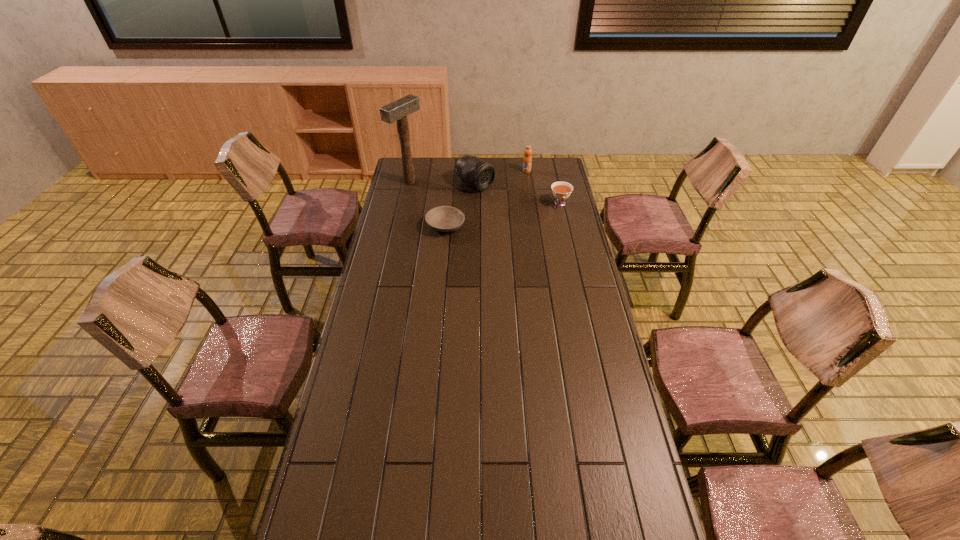
This screenshot has width=960, height=540. I want to click on the shortest object, so click(442, 218).

Locate an element on the screen. Image resolution: width=960 pixels, height=540 pixels. bowl is located at coordinates (442, 218).

At what (x,y) coordinates should I click in order to perform the action: click on teacup. Please return your answer as a coordinate pair (x, y). Looking at the image, I should click on (561, 190).

Where is `the second shortest object`? the second shortest object is located at coordinates (561, 190).

Where is `mallet`? This screenshot has height=540, width=960. mallet is located at coordinates (398, 110).

Where is `the leftmost object`? This screenshot has width=960, height=540. the leftmost object is located at coordinates (398, 110).

Where is `telephoto lens`? telephoto lens is located at coordinates (479, 174).

At what (x,y) coordinates should I click in order to perform the action: click on orange juice. Please return your answer as a coordinate pair (x, y). This screenshot has height=540, width=960. Looking at the image, I should click on (527, 160).

Where is `vacant space located on the back of the bowl`? The image size is (960, 540). vacant space located on the back of the bowl is located at coordinates (450, 179).

This screenshot has width=960, height=540. I want to click on free location located 0.090m on the side of the fourth farthest object with the handle, so click(x=564, y=222).